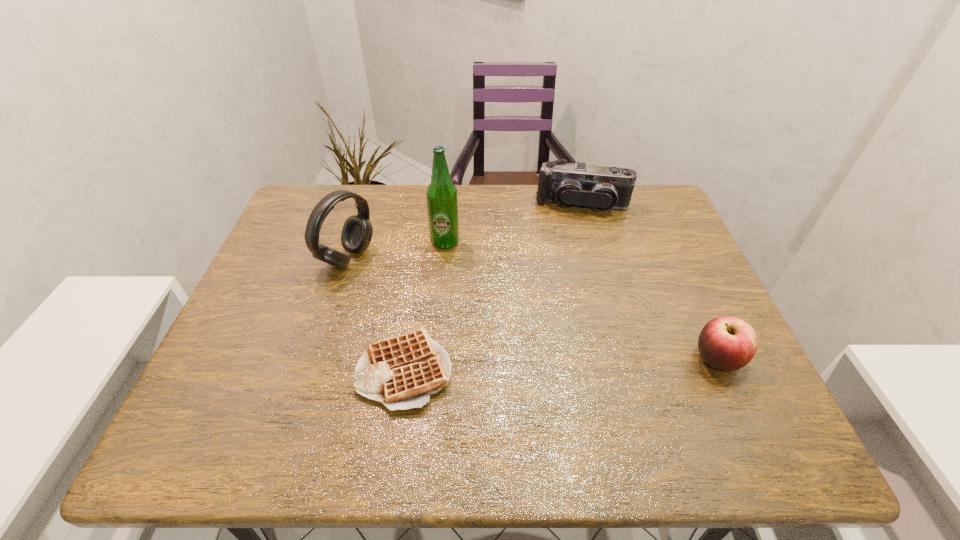
Image resolution: width=960 pixels, height=540 pixels. What are the coordinates of `vacant space at the far left corner of the desktop` in the screenshot? It's located at (312, 198).

In order to click on free space at the far right corner of the desktop in this screenshot , I will do `click(644, 224)`.

Where is `empty location between the leftmost object and the second object from right to left`? This screenshot has height=540, width=960. empty location between the leftmost object and the second object from right to left is located at coordinates (465, 231).

Identify the location of vacant point located between the second shortest object and the headset. (533, 309).

Identify the location of free space that is in between the tallest object and the second shortest object. (581, 301).

Identify the location of vacant area that lies between the camcorder and the fourth tallest object. (649, 282).

Where is `empty location between the camcorder and the shortest object`? This screenshot has width=960, height=540. empty location between the camcorder and the shortest object is located at coordinates (492, 287).

Locate an element on the screen. This screenshot has height=540, width=960. empty space that is in between the farthest object and the headset is located at coordinates (465, 231).

What are the coordinates of `vacant region between the beer bottle and the rightmost object` in the screenshot? It's located at (581, 301).

Where is `vacant region between the tallest object and the fourth shortest object`? Image resolution: width=960 pixels, height=540 pixels. vacant region between the tallest object and the fourth shortest object is located at coordinates (396, 250).